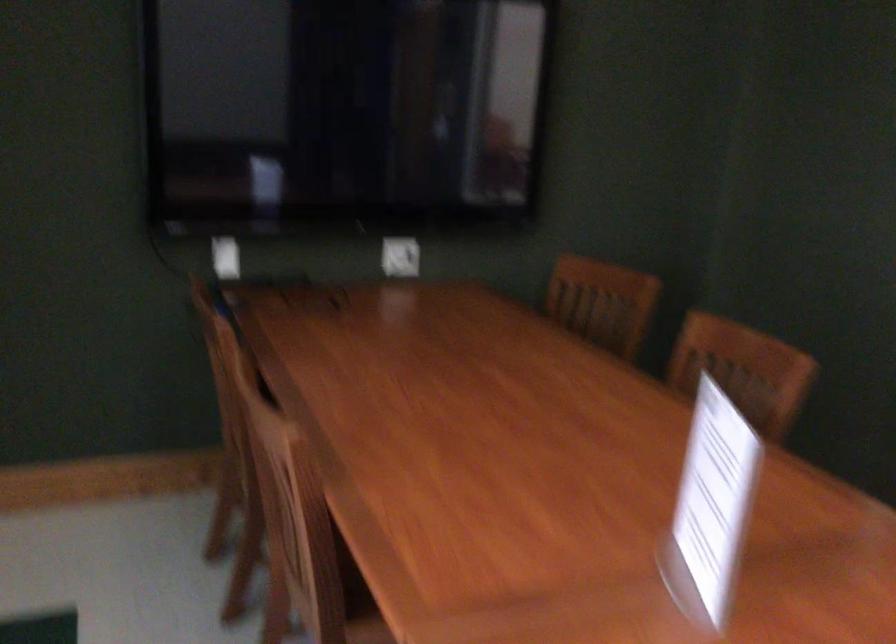
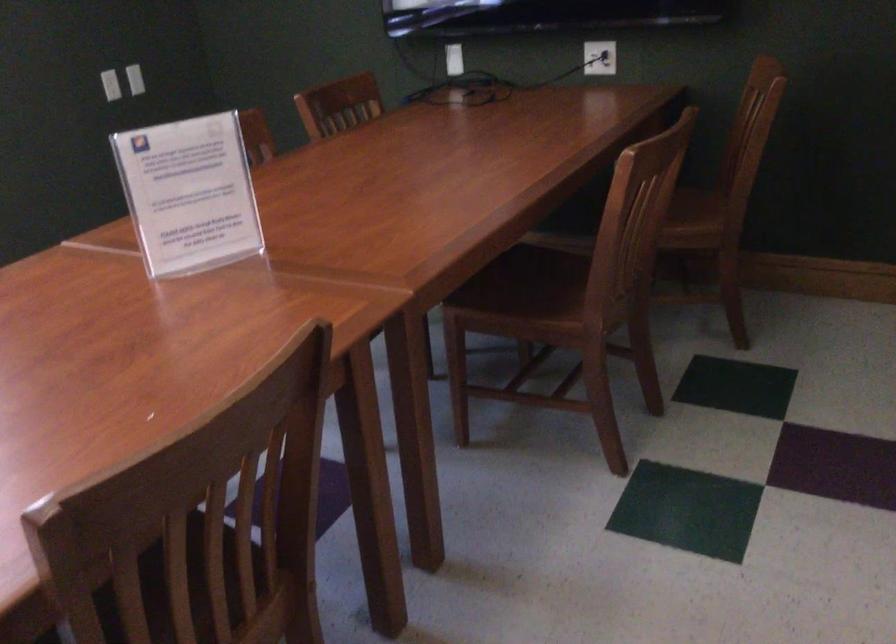
Find the pixel in the second image that matches point (246, 259) in the first image.

(453, 59)